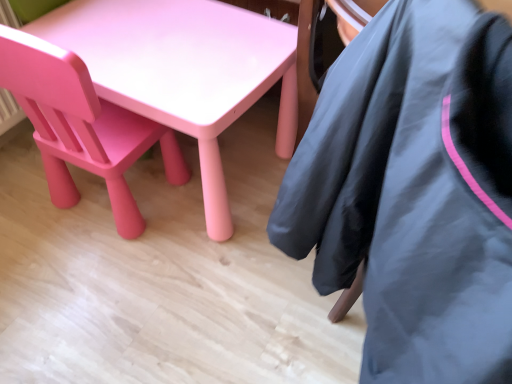
Find the location of a particular element. vacant space positioned to the left of matte pink plastic chair at lower left is located at coordinates (25, 196).